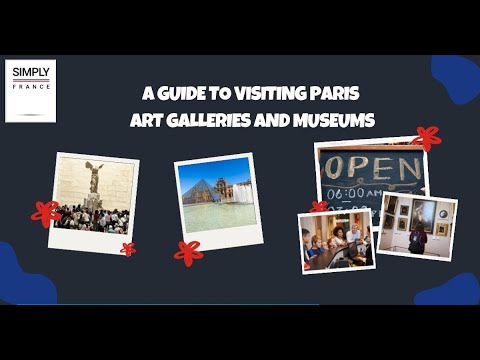
This screenshot has height=360, width=480. I want to click on title on bulletin board, so click(x=198, y=94), click(x=269, y=103), click(x=324, y=93), click(x=166, y=122), click(x=273, y=119), click(x=332, y=128).